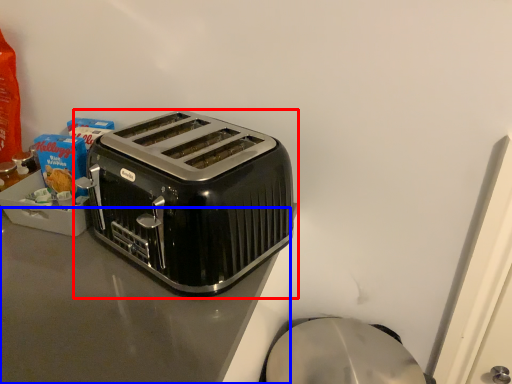
Question: Which point is further to the camera, toaster (highlighted by a red box) or counter top (highlighted by a blue box)?

Choices:
 (A) toaster
 (B) counter top

Answer: (A)